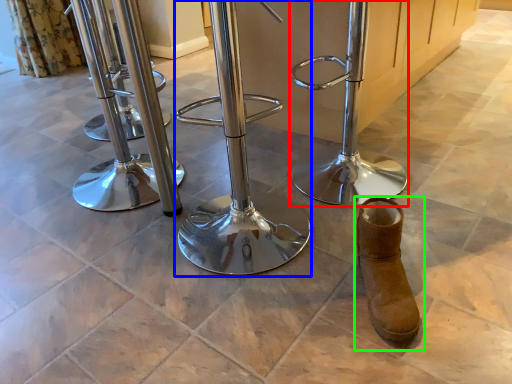
Question: Which is nearer to the swivel chair (highlighted by a red box)? swivel chair (highlighted by a blue box) or footwear (highlighted by a green box).

Choices:
 (A) swivel chair
 (B) footwear

Answer: (A)